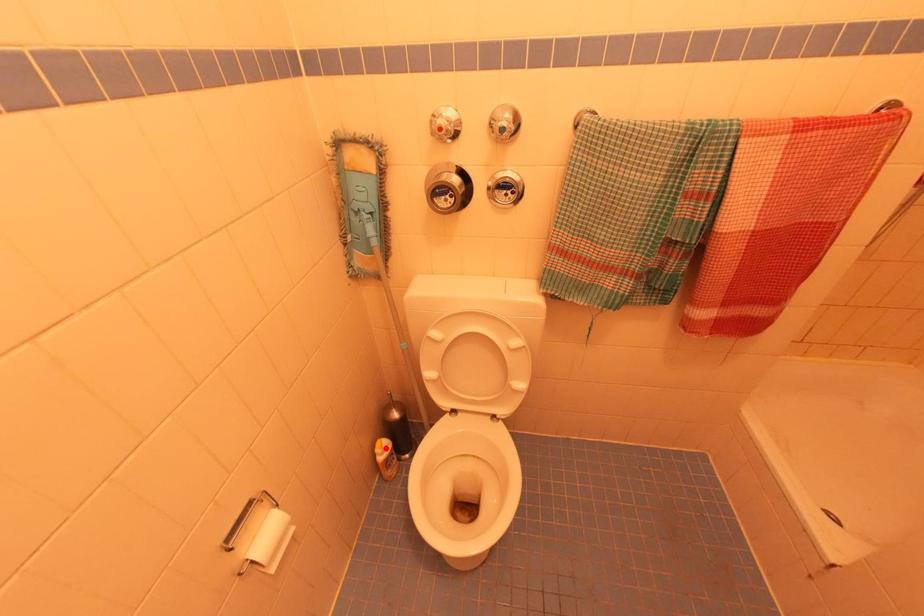
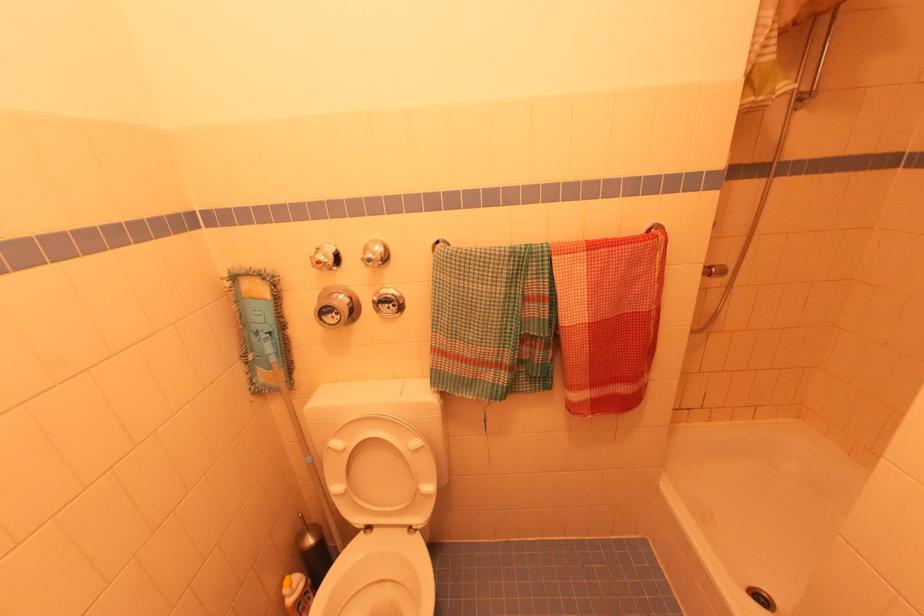
Find the pixel in the second image that matches the highlighted location in the first image.

(296, 585)